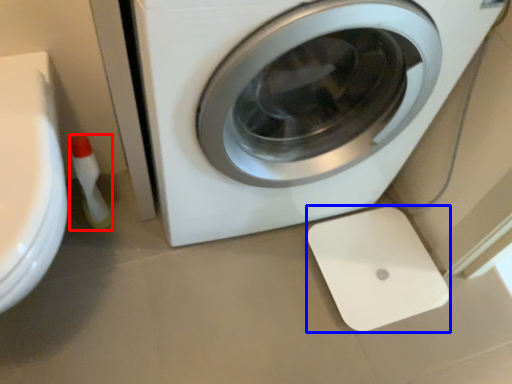
Question: Which object is closer to the camera taking this photo, cleaning product (highlighted by a red box) or appliance (highlighted by a blue box)?

Choices:
 (A) cleaning product
 (B) appliance

Answer: (A)